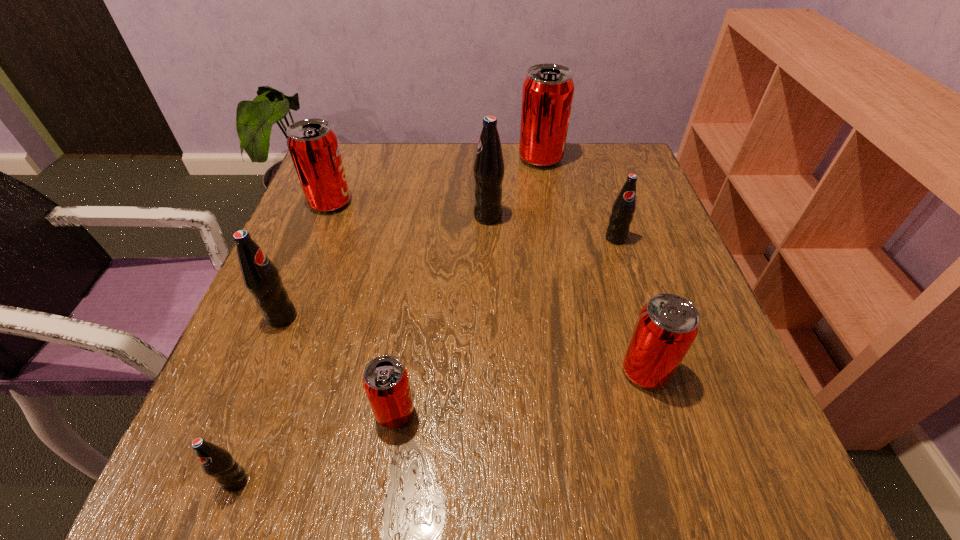
Identify the location of the sixth farthest pop. The width and height of the screenshot is (960, 540). (668, 324).

At what (x,y) coordinates should I click in order to perform the action: click on the rightmost red soda can. Please return your answer as a coordinate pair (x, y). The width and height of the screenshot is (960, 540). Looking at the image, I should click on (668, 324).

This screenshot has height=540, width=960. Identify the location of the nearest red soda can. (385, 380).

At what (x,y) coordinates should I click in order to perform the action: click on the second nearest pop. Please return your answer as a coordinate pair (x, y). Looking at the image, I should click on (385, 380).

The image size is (960, 540). What are the coordinates of `the nearest pop` in the screenshot? It's located at (218, 463).

Find the location of `the nearest object`. the nearest object is located at coordinates (218, 463).

Locate an element on the screen. The width and height of the screenshot is (960, 540). free location located 0.330m on the left of the third object from right to left is located at coordinates (393, 159).

This screenshot has height=540, width=960. I want to click on free space located on the front label of the farthest black pop, so click(429, 217).

Locate an element on the screen. vacant space located 0.080m on the front label of the farthest black pop is located at coordinates (438, 217).

Locate an element on the screen. The width and height of the screenshot is (960, 540). vacant space situated 0.400m on the front label of the farthest black pop is located at coordinates (296, 217).